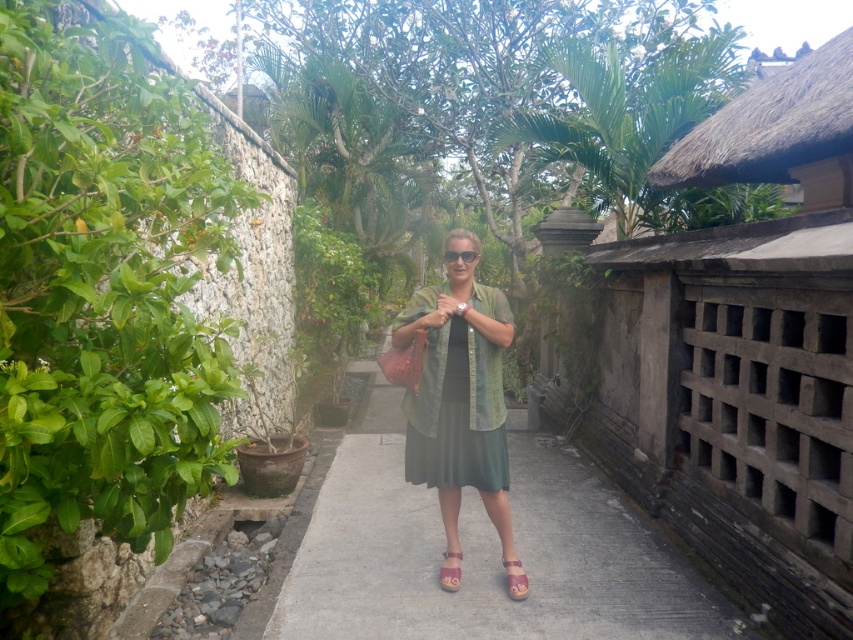
Can you confirm if gray concrete pavement at center is positioned above green linen dress at center?

Incorrect, gray concrete pavement at center is not positioned above green linen dress at center.

Can you confirm if gray concrete pavement at center is thinner than green linen dress at center?

No.

Who is more distant from viewer, (636, 515) or (486, 470)?

The point (636, 515) is more distant.

At what (x,y) coordinates should I click in order to perform the action: click on gray concrete pavement at center. Please return your answer as a coordinate pair (x, y). This screenshot has width=853, height=640. Looking at the image, I should click on (485, 554).

At what (x,y) coordinates should I click in order to perform the action: click on brown leather sandal at center. Please return your answer as a coordinate pair (x, y). This screenshot has height=640, width=853. Looking at the image, I should click on (450, 570).

Does green linen dress at center lie in front of matte black sunglasses at center?

Yes, green linen dress at center is closer to the viewer.

The height and width of the screenshot is (640, 853). What are the coordinates of `green linen dress at center` in the screenshot? It's located at (459, 397).